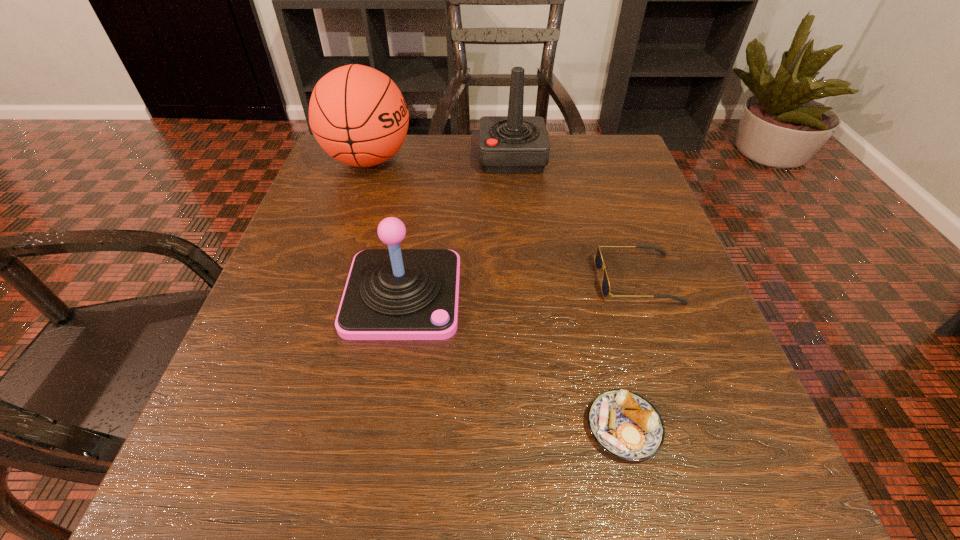
Find the location of a particular element. The height and width of the screenshot is (540, 960). vacant space located on the front-facing side of the right joystick is located at coordinates (445, 158).

The image size is (960, 540). In order to click on vacant space located 0.090m on the front-facing side of the right joystick in this screenshot , I will do `click(441, 158)`.

Where is `vacant space located forward from the base of the left joystick`? vacant space located forward from the base of the left joystick is located at coordinates (389, 382).

The height and width of the screenshot is (540, 960). Identify the location of vacant space located 0.320m on the front-facing side of the fourth tallest object. (410, 279).

At what (x,y) coordinates should I click in order to perform the action: click on free location located 0.080m on the front-facing side of the fourth tallest object. Please return your answer as a coordinate pair (x, y). The height and width of the screenshot is (540, 960). Looking at the image, I should click on (551, 279).

The width and height of the screenshot is (960, 540). Identify the location of blank space located on the front-facing side of the fourth tallest object. (545, 279).

At what (x,y) coordinates should I click in order to perform the action: click on free space located on the back of the pastry. Please return your answer as a coordinate pair (x, y). Looking at the image, I should click on (606, 351).

Image resolution: width=960 pixels, height=540 pixels. I want to click on basketball that is at the far edge, so click(358, 115).

Locate an element on the screen. The width and height of the screenshot is (960, 540). joystick that is at the far edge is located at coordinates (515, 143).

Find the location of a particular element. This screenshot has width=960, height=540. object present at the near edge is located at coordinates (624, 424).